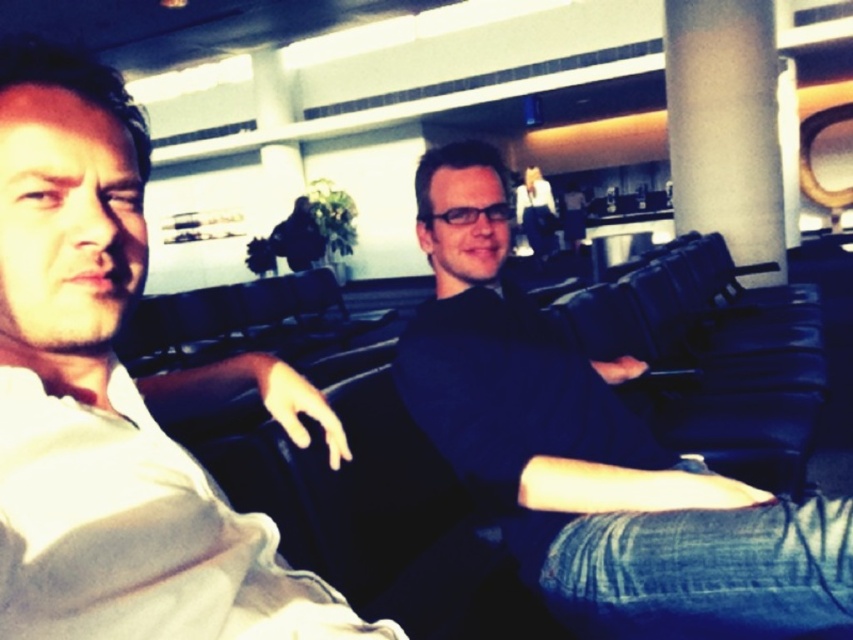
Can you confirm if white cotton shirt at left is positioned below dark blue fabric at center?

No.

Who is higher up, white cotton shirt at left or dark blue fabric at center?

white cotton shirt at left is above.

Is point (131, 168) positioned after point (457, 362)?

No, (131, 168) is in front of (457, 362).

Where is `white cotton shirt at left`? white cotton shirt at left is located at coordinates (119, 401).

Does point (769, 605) come farther from viewer compared to point (746, 285)?

No, (769, 605) is in front of (746, 285).

Measure the distance between point (440, 200) and camera.

Point (440, 200) and camera are 1.37 meters apart.

Locate an element on the screen. The height and width of the screenshot is (640, 853). dark blue fabric at center is located at coordinates (595, 456).

Is white cotton shirt at left to the right of white matte pillar at center from the viewer's perspective?

No, white cotton shirt at left is not to the right of white matte pillar at center.

Which is behind, point (9, 490) or point (741, 76)?

Positioned behind is point (741, 76).

Locate an element on the screen. The width and height of the screenshot is (853, 640). white cotton shirt at left is located at coordinates (119, 401).